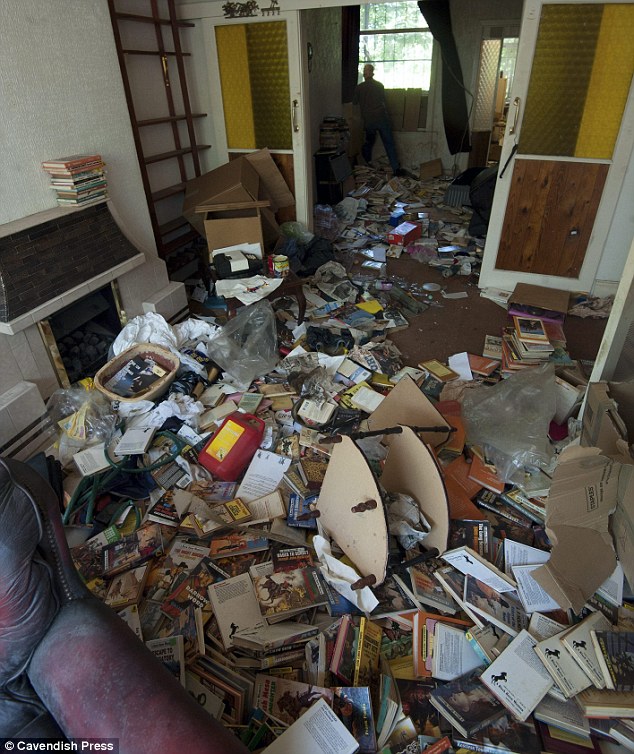
Locate an element on the screen. The height and width of the screenshot is (754, 634). carpet is located at coordinates (454, 325).